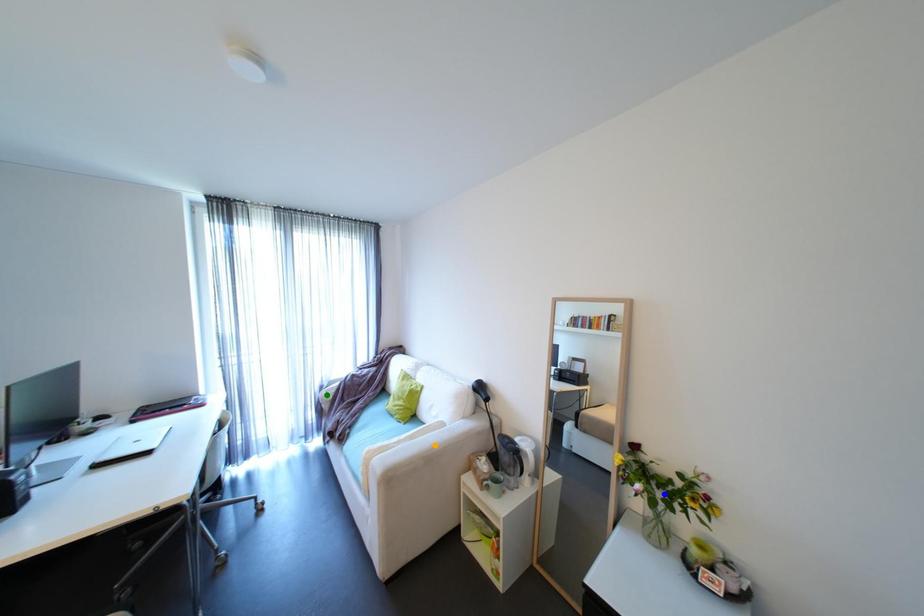
Order these from nearest to farthest:
green point
orange point
blue point

blue point → orange point → green point